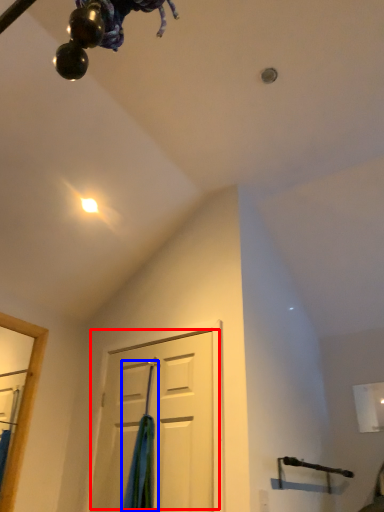
Question: Which point is further to the camera, door (highlighted by a red box) or curtain (highlighted by a blue box)?

Choices:
 (A) door
 (B) curtain

Answer: (B)